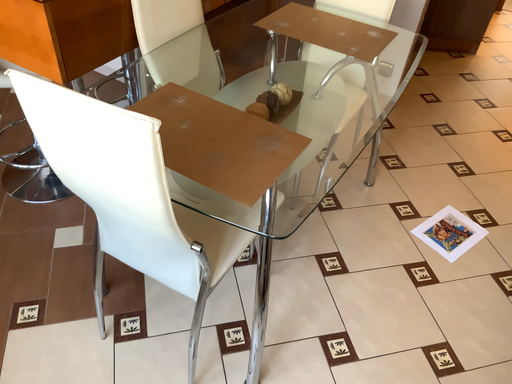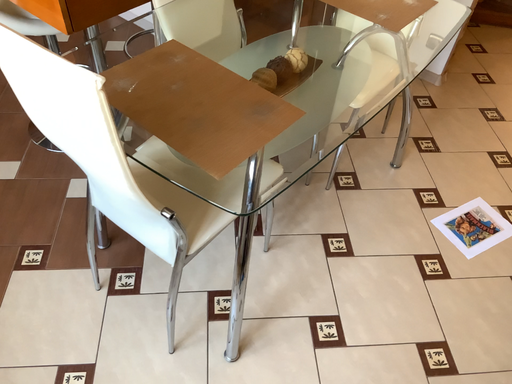
Question: How did the camera likely rotate when shooting the video?

Choices:
 (A) rotated right
 (B) rotated left

Answer: (B)